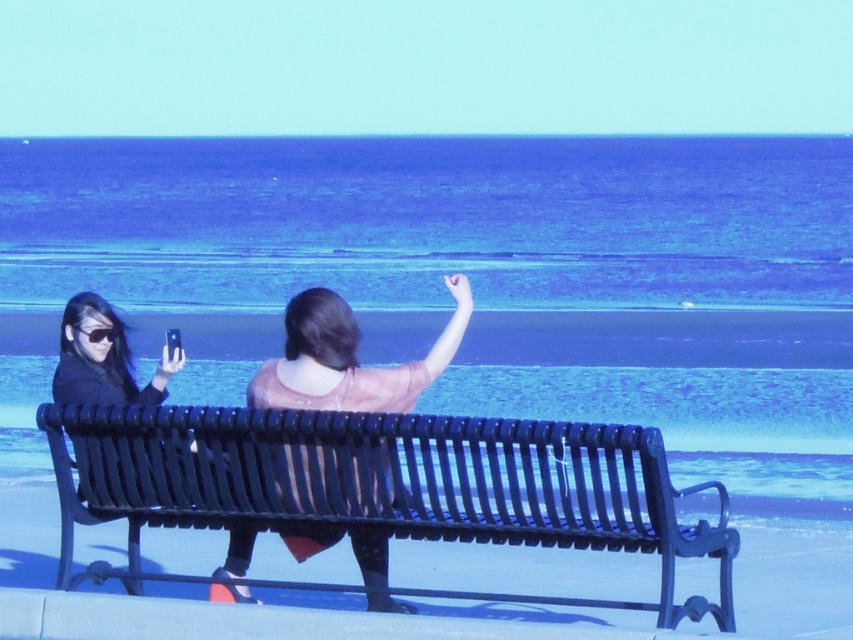
You are a photographer trying to capture the pink sheer blouse at center and the matte black goggles at left in the same frame. Based on their positions, which object should you focus on first to ensure both are in the shot?

The pink sheer blouse at center is located below matte black goggles at left, so you should focus on the matte black goggles at left first to ensure both objects are within the frame.

You are a photographer trying to capture a closeup shot of the matte black hair at left and the matte black goggles at left. Which object should you zoom in more on to ensure it fills the frame appropriately?

The matte black hair at left has a larger width than the matte black goggles at left, so you should zoom in more on the matte black goggles at left to ensure it fills the frame appropriately.